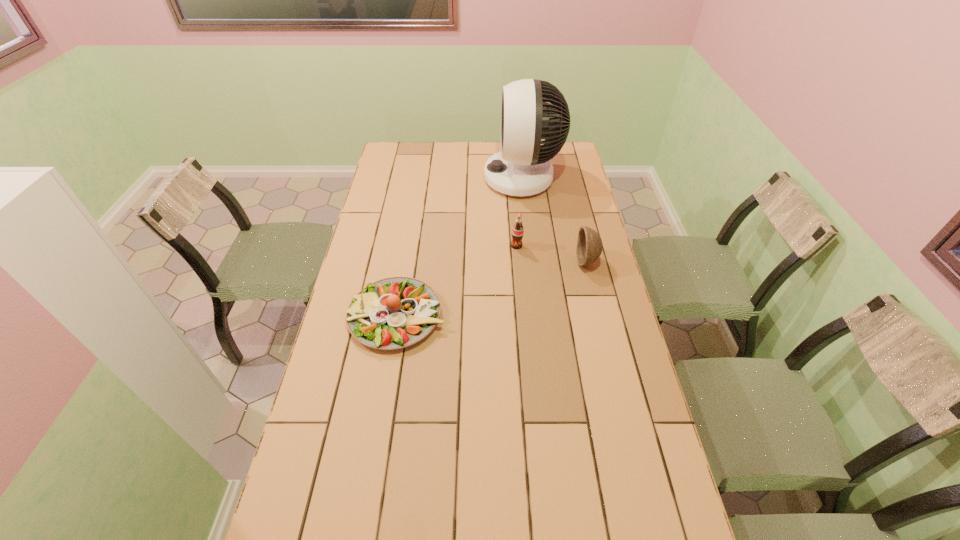
Point out which object is positioned as the second nearest to the soda. Please provide its 2D coordinates. Your answer should be formatted as a tuple, i.e. [(x, y)], where the tuple contains the x and y coordinates of a point satisfying the conditions above.

[(522, 168)]

Identify the location of vacant space that satisfies the following two spatial constraints: 1. on the grille of the fan; 2. on the front side of the soda. (530, 246).